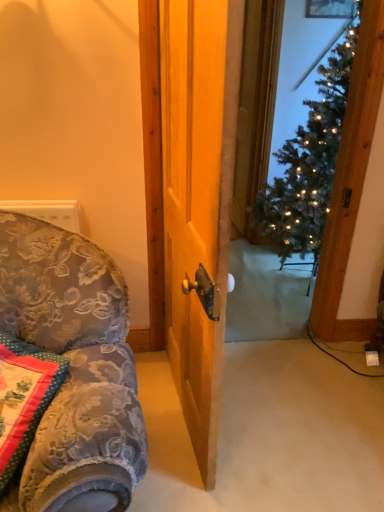
Question: Is iridescent metallic christmas tree at center far from floral fabric pillow at lower left?

Choices:
 (A) no
 (B) yes

Answer: (B)

Question: Is iridescent metallic christmas tree at center at the left side of floral fabric pillow at lower left?

Choices:
 (A) yes
 (B) no

Answer: (B)

Question: Is the position of iridescent metallic christmas tree at center more distant than that of floral fabric pillow at lower left?

Choices:
 (A) yes
 (B) no

Answer: (A)

Question: From the image's perspective, is iridescent metallic christmas tree at center above floral fabric pillow at lower left?

Choices:
 (A) yes
 (B) no

Answer: (A)

Question: Is iridescent metallic christmas tree at center looking in the opposite direction of floral fabric pillow at lower left?

Choices:
 (A) yes
 (B) no

Answer: (B)

Question: Is floral fabric pillow at lower left completely or partially inside iridescent metallic christmas tree at center?

Choices:
 (A) yes
 (B) no

Answer: (B)

Question: Is floral fabric pillow at lower left positioned with its back to iridescent metallic christmas tree at center?

Choices:
 (A) no
 (B) yes

Answer: (B)

Question: Is floral fabric pillow at lower left oriented towards iridescent metallic christmas tree at center?

Choices:
 (A) no
 (B) yes

Answer: (A)

Question: Can iridescent metallic christmas tree at center be found inside floral fabric pillow at lower left?

Choices:
 (A) yes
 (B) no

Answer: (B)

Question: Does floral fabric pillow at lower left appear on the right side of iridescent metallic christmas tree at center?

Choices:
 (A) yes
 (B) no

Answer: (B)

Question: Considering the relative sizes of floral fabric pillow at lower left and iridescent metallic christmas tree at center in the image provided, is floral fabric pillow at lower left smaller than iridescent metallic christmas tree at center?

Choices:
 (A) yes
 (B) no

Answer: (A)

Question: From the image's perspective, is floral fabric pillow at lower left over iridescent metallic christmas tree at center?

Choices:
 (A) yes
 (B) no

Answer: (B)

Question: From the image's perspective, relative to floral fabric pillow at lower left, is iridescent metallic christmas tree at center above or below?

Choices:
 (A) above
 (B) below

Answer: (A)